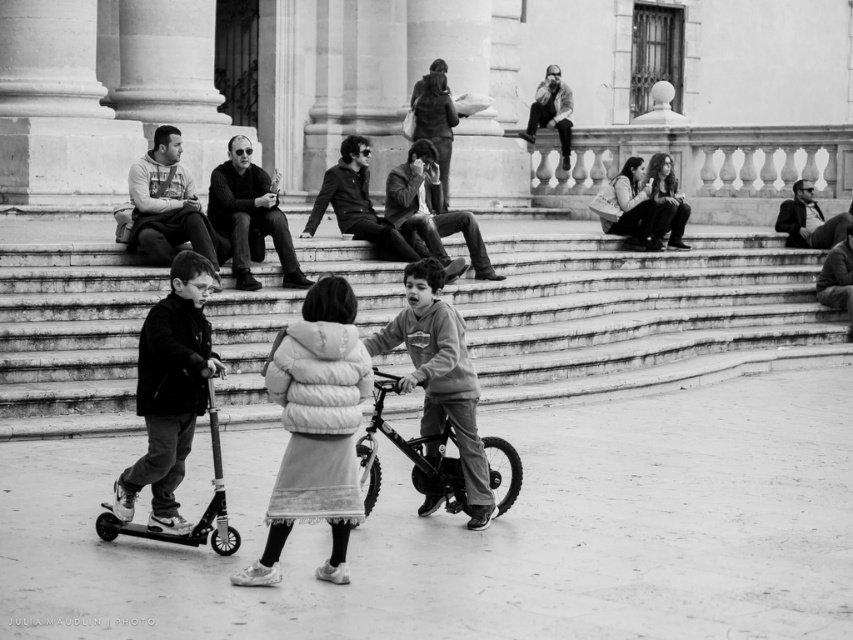
Consider the image. Measure the distance from smooth concrete stairs at center to white fluffy coat at center.

smooth concrete stairs at center is 14.32 meters from white fluffy coat at center.

Which is behind, point (496, 346) or point (329, 513)?

Point (496, 346)

The width and height of the screenshot is (853, 640). What are the coordinates of `smooth concrete stairs at center` in the screenshot? It's located at (640, 314).

Does dark gray fleece jacket at center have a lesser height compared to metallic silver bicycle at center?

Incorrect, dark gray fleece jacket at center's height does not fall short of metallic silver bicycle at center's.

Which is in front, point (144, 465) or point (515, 490)?

Point (144, 465)

Where is `dark gray fleece jacket at center`? dark gray fleece jacket at center is located at coordinates (170, 392).

Can you confirm if white fluffy coat at center is smaller than dark gray fleece jacket at center?

Actually, white fluffy coat at center might be larger than dark gray fleece jacket at center.

Is white fluffy coat at center above dark gray fleece jacket at center?

No, white fluffy coat at center is not above dark gray fleece jacket at center.

The width and height of the screenshot is (853, 640). I want to click on white fluffy coat at center, so click(x=315, y=428).